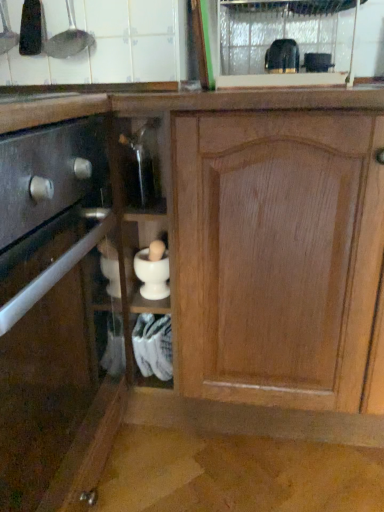
The width and height of the screenshot is (384, 512). What do you see at coordinates (45, 387) in the screenshot? I see `matte black drawer at left, acting as the 2th cabinetry starting from the right` at bounding box center [45, 387].

Identify the location of black plastic toaster at upper center, which is counted as the 6th appliance, starting from the left. (317, 62).

This screenshot has width=384, height=512. I want to click on black plastic toaster at upper center, positioned as the 2th appliance in right-to-left order, so click(x=282, y=56).

At what (x,y) coordinates should I click in order to perform the action: click on metallic silver ladle at upper left, placed as the 6th appliance when sorted from right to left. Please return your answer as a coordinate pair (x, y). The width and height of the screenshot is (384, 512). Looking at the image, I should click on (6, 31).

What is the approximate height of metallic silver ladle at upper left, the 1th appliance in the left-to-right sequence?

metallic silver ladle at upper left, the 1th appliance in the left-to-right sequence, is 13.72 inches tall.

Image resolution: width=384 pixels, height=512 pixels. In order to click on wooden cabinet at center, which is the second cabinetry in left-to-right order in this screenshot , I will do `click(276, 255)`.

Where is `matte black drawer at left, the 1th cabinetry when ordered from left to right`? The image size is (384, 512). matte black drawer at left, the 1th cabinetry when ordered from left to right is located at coordinates (45, 387).

Can you see transparent glass bottle at center, acting as the 4th appliance starting from the right, touching transparent plastic glass door at upper center?

No, transparent glass bottle at center, acting as the 4th appliance starting from the right, is not beside transparent plastic glass door at upper center.

From the image's perspective, count 3rd appliances downward from the transparent plastic glass door at upper center and point to it. Please provide its 2D coordinates.

[(141, 166)]

How different are the orientations of transparent glass bottle at center, acting as the 4th appliance starting from the right, and transparent plastic glass door at upper center in degrees?

The angle between the facing direction of transparent glass bottle at center, acting as the 4th appliance starting from the right, and the facing direction of transparent plastic glass door at upper center is 0.0455 degrees.

At what (x,y) coordinates should I click in order to perform the action: click on the 2nd appliance positioned below the transparent plastic glass door at upper center (from the image's perspective). Please return your answer as a coordinate pair (x, y). The height and width of the screenshot is (512, 384). Looking at the image, I should click on (317, 62).

Between black plastic toaster at upper center, which appears as the first appliance when viewed from the right, and transparent plastic glass door at upper center, which one is positioned behind?

black plastic toaster at upper center, which appears as the first appliance when viewed from the right, is more distant.

Is black plastic toaster at upper center, which is counted as the 6th appliance, starting from the left, shorter than transparent plastic glass door at upper center?

Indeed, black plastic toaster at upper center, which is counted as the 6th appliance, starting from the left, has a lesser height compared to transparent plastic glass door at upper center.

Which of these two, black plastic toaster at upper center, which appears as the first appliance when viewed from the right, or transparent plastic glass door at upper center, is bigger?

transparent plastic glass door at upper center.

Is matte black drawer at left, the 1th cabinetry when ordered from left to right, at the back of white matte mortar and pestle at center, positioned as the 4th appliance in left-to-right order?

That's not correct — white matte mortar and pestle at center, positioned as the 4th appliance in left-to-right order, is not looking away from matte black drawer at left, the 1th cabinetry when ordered from left to right.

Which object is more forward, white matte mortar and pestle at center, positioned as the 4th appliance in left-to-right order, or matte black drawer at left, acting as the 2th cabinetry starting from the right?

matte black drawer at left, acting as the 2th cabinetry starting from the right, is in front.

Is white matte mortar and pestle at center, which appears as the 3th appliance when viewed from the right, not close to matte black drawer at left, acting as the 2th cabinetry starting from the right?

No, there isn't a large distance between white matte mortar and pestle at center, which appears as the 3th appliance when viewed from the right, and matte black drawer at left, acting as the 2th cabinetry starting from the right.

Which point is more distant from viewer, (166,295) or (55,447)?

The point (55,447) is farther.

Is the surface of transparent plastic glass door at upper center in direct contact with white matte mortar and pestle at center, which appears as the 3th appliance when viewed from the right?

No, transparent plastic glass door at upper center is not next to white matte mortar and pestle at center, which appears as the 3th appliance when viewed from the right.

Is transparent plastic glass door at upper center oriented away from white matte mortar and pestle at center, which appears as the 3th appliance when viewed from the right?

transparent plastic glass door at upper center does not have its back to white matte mortar and pestle at center, which appears as the 3th appliance when viewed from the right.

Between transparent plastic glass door at upper center and white matte mortar and pestle at center, positioned as the 4th appliance in left-to-right order, which one has larger size?

With larger size is transparent plastic glass door at upper center.

From a real-world perspective, does transparent plastic glass door at upper center sit lower than white matte mortar and pestle at center, positioned as the 4th appliance in left-to-right order?

Incorrect, from a real-world perspective, transparent plastic glass door at upper center is higher than white matte mortar and pestle at center, positioned as the 4th appliance in left-to-right order.

You are a GUI agent. You are given a task and a screenshot of the screen. Output one action in this format:
    pyautogui.click(x=<x>, y=<y>)
    Task: Click on the cabinetry that appears on the left of black plastic toaster at upper center, the 5th appliance when ordered from left to right
    This screenshot has width=384, height=512.
    Given the screenshot: What is the action you would take?
    pyautogui.click(x=45, y=387)

Does point (277, 71) come behind point (79, 215)?

Yes, point (277, 71) is farther from viewer.

Which object is wider, black plastic toaster at upper center, positioned as the 2th appliance in right-to-left order, or matte black drawer at left, the 1th cabinetry when ordered from left to right?

Wider between the two is matte black drawer at left, the 1th cabinetry when ordered from left to right.

Based on their positions, is black plastic toaster at upper center, positioned as the 2th appliance in right-to-left order, located to the left or right of matte black drawer at left, the 1th cabinetry when ordered from left to right?

In the image, black plastic toaster at upper center, positioned as the 2th appliance in right-to-left order, appears on the right side of matte black drawer at left, the 1th cabinetry when ordered from left to right.

Are white matte mortar and pestle at center, which appears as the 3th appliance when viewed from the right, and wooden cabinet at center, the first cabinetry in the right-to-left sequence, beside each other?

No, white matte mortar and pestle at center, which appears as the 3th appliance when viewed from the right, is not in contact with wooden cabinet at center, the first cabinetry in the right-to-left sequence.

Which object is positioned more to the right, white matte mortar and pestle at center, which appears as the 3th appliance when viewed from the right, or wooden cabinet at center, which is the second cabinetry in left-to-right order?

wooden cabinet at center, which is the second cabinetry in left-to-right order, is more to the right.

Considering the relative sizes of white matte mortar and pestle at center, positioned as the 4th appliance in left-to-right order, and wooden cabinet at center, which is the second cabinetry in left-to-right order, in the image provided, is white matte mortar and pestle at center, positioned as the 4th appliance in left-to-right order, bigger than wooden cabinet at center, which is the second cabinetry in left-to-right order,?

Incorrect, white matte mortar and pestle at center, positioned as the 4th appliance in left-to-right order, is not larger than wooden cabinet at center, which is the second cabinetry in left-to-right order.

How different are the orientations of white matte mortar and pestle at center, positioned as the 4th appliance in left-to-right order, and wooden cabinet at center, the first cabinetry in the right-to-left sequence, in degrees?

The angular difference between white matte mortar and pestle at center, positioned as the 4th appliance in left-to-right order, and wooden cabinet at center, the first cabinetry in the right-to-left sequence, is 0.163 degrees.

Is metallic silver ladle at upper left, the 1th appliance in the left-to-right sequence, with white matte mortar and pestle at center, positioned as the 4th appliance in left-to-right order?

No, metallic silver ladle at upper left, the 1th appliance in the left-to-right sequence, is not making contact with white matte mortar and pestle at center, positioned as the 4th appliance in left-to-right order.

Is metallic silver ladle at upper left, the 1th appliance in the left-to-right sequence, oriented towards white matte mortar and pestle at center, which appears as the 3th appliance when viewed from the right?

No, metallic silver ladle at upper left, the 1th appliance in the left-to-right sequence, does not turn towards white matte mortar and pestle at center, which appears as the 3th appliance when viewed from the right.

Locate an element on the screen. The width and height of the screenshot is (384, 512). appliance that is the 5th one when counting upward from the white matte mortar and pestle at center, positioned as the 4th appliance in left-to-right order (from the image's perspective) is located at coordinates (6, 31).

Is metallic silver ladle at upper left, placed as the 6th appliance when sorted from right to left, completely or partially outside of white matte mortar and pestle at center, which appears as the 3th appliance when viewed from the right?

Yes, metallic silver ladle at upper left, placed as the 6th appliance when sorted from right to left, is located beyond the bounds of white matte mortar and pestle at center, which appears as the 3th appliance when viewed from the right.

What are the coordinates of `appliance that is the 1st object located behind the transparent plastic glass door at upper center` in the screenshot? It's located at (141, 166).

From the image's perspective, which appliance is the 2nd one below the transparent plastic glass door at upper center? Please provide its 2D coordinates.

[(317, 62)]

When comparing their distances from wooden cabinet at center, the first cabinetry in the right-to-left sequence, does matte black drawer at left, acting as the 2th cabinetry starting from the right, or transparent plastic glass door at upper center seem closer?

Based on the image, matte black drawer at left, acting as the 2th cabinetry starting from the right, appears to be nearer to wooden cabinet at center, the first cabinetry in the right-to-left sequence.

Estimate the real-world distances between objects in this image. Which object is further from transparent glass bottle at center, acting as the 4th appliance starting from the right, black plastic toaster at upper center, which appears as the first appliance when viewed from the right, or metallic silver ladle at upper left, the 1th appliance in the left-to-right sequence?

The object further to transparent glass bottle at center, acting as the 4th appliance starting from the right, is black plastic toaster at upper center, which appears as the first appliance when viewed from the right.

When comparing their distances from metallic silver ladle at upper left, the 1th appliance in the left-to-right sequence, does metallic spoon at upper left, marked as the second appliance in a left-to-right arrangement, or black plastic toaster at upper center, positioned as the 2th appliance in right-to-left order, seem closer?

metallic spoon at upper left, marked as the second appliance in a left-to-right arrangement.

Considering their positions, is transparent plastic glass door at upper center positioned closer to metallic spoon at upper left, which ranks as the 5th appliance in right-to-left order, than black plastic toaster at upper center, which is counted as the 6th appliance, starting from the left?

transparent plastic glass door at upper center.

From the image, which object appears to be farther from metallic spoon at upper left, marked as the second appliance in a left-to-right arrangement, black plastic toaster at upper center, which is counted as the 6th appliance, starting from the left, or white matte mortar and pestle at center, positioned as the 4th appliance in left-to-right order?

Based on the image, black plastic toaster at upper center, which is counted as the 6th appliance, starting from the left, appears to be further to metallic spoon at upper left, marked as the second appliance in a left-to-right arrangement.

Considering their positions, is metallic spoon at upper left, marked as the second appliance in a left-to-right arrangement, positioned further to matte black drawer at left, the 1th cabinetry when ordered from left to right, than wooden cabinet at center, which is the second cabinetry in left-to-right order?

The object further to matte black drawer at left, the 1th cabinetry when ordered from left to right, is metallic spoon at upper left, marked as the second appliance in a left-to-right arrangement.

From the image, which object appears to be farther from transparent plastic glass door at upper center, white matte mortar and pestle at center, positioned as the 4th appliance in left-to-right order, or metallic silver ladle at upper left, placed as the 6th appliance when sorted from right to left?

metallic silver ladle at upper left, placed as the 6th appliance when sorted from right to left.

Estimate the real-world distances between objects in this image. Which object is further from black plastic toaster at upper center, which is counted as the 6th appliance, starting from the left, wooden cabinet at center, which is the second cabinetry in left-to-right order, or matte black drawer at left, acting as the 2th cabinetry starting from the right?

Based on the image, matte black drawer at left, acting as the 2th cabinetry starting from the right, appears to be further to black plastic toaster at upper center, which is counted as the 6th appliance, starting from the left.

The height and width of the screenshot is (512, 384). I want to click on appliance between black plastic toaster at upper center, which appears as the first appliance when viewed from the right, and white matte mortar and pestle at center, positioned as the 4th appliance in left-to-right order, vertically, so click(x=141, y=166).

Image resolution: width=384 pixels, height=512 pixels. I want to click on cabinetry between black plastic toaster at upper center, positioned as the 2th appliance in right-to-left order, and white matte mortar and pestle at center, positioned as the 4th appliance in left-to-right order, in the up-down direction, so click(x=276, y=255).

The width and height of the screenshot is (384, 512). Find the location of `glass door between transparent glass bottle at center, the third appliance viewed from the left, and black plastic toaster at upper center, which appears as the first appliance when viewed from the right, from left to right`. glass door between transparent glass bottle at center, the third appliance viewed from the left, and black plastic toaster at upper center, which appears as the first appliance when viewed from the right, from left to right is located at coordinates (284, 42).

Where is `glass door between metallic silver ladle at upper left, the 1th appliance in the left-to-right sequence, and white matte mortar and pestle at center, positioned as the 4th appliance in left-to-right order, vertically`? glass door between metallic silver ladle at upper left, the 1th appliance in the left-to-right sequence, and white matte mortar and pestle at center, positioned as the 4th appliance in left-to-right order, vertically is located at coordinates (284, 42).